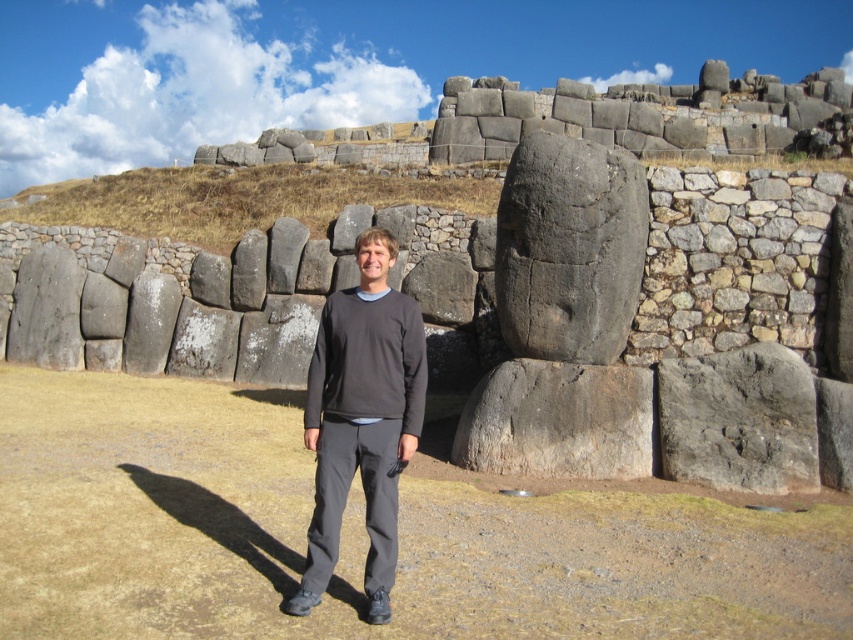
Is point (512, 340) positioned before point (538, 451)?

That is False.

Describe the element at coordinates (569, 250) in the screenshot. The image size is (853, 640). I see `gray stone carving at center` at that location.

Identify the location of gray stone carving at center. (569, 250).

In the scene shown: Can you confirm if gray stone statue at center is taller than dark gray sweater at center?

Correct, gray stone statue at center is much taller as dark gray sweater at center.

Can you confirm if gray stone statue at center is shorter than dark gray sweater at center?

In fact, gray stone statue at center may be taller than dark gray sweater at center.

Is point (465, 250) more distant than point (314, 420)?

Yes.

Where is `gray stone statue at center`? This screenshot has height=640, width=853. gray stone statue at center is located at coordinates (526, 298).

Consider the image. Can you confirm if dark gray sweater at center is shorter than gray rough stone boulder at center?

Incorrect, dark gray sweater at center's height does not fall short of gray rough stone boulder at center's.

Does dark gray sweater at center have a smaller size compared to gray rough stone boulder at center?

No, dark gray sweater at center is not smaller than gray rough stone boulder at center.

This screenshot has width=853, height=640. I want to click on dark gray sweater at center, so click(x=363, y=419).